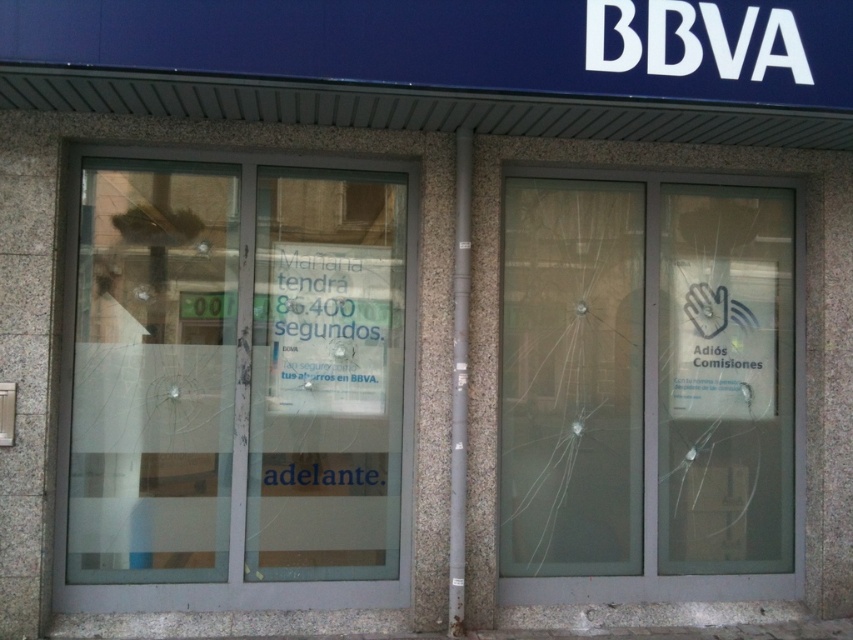
Is transparent glass door at center below transparent glass door at right?

Actually, transparent glass door at center is above transparent glass door at right.

Where is `transparent glass door at center`? transparent glass door at center is located at coordinates [239, 381].

This screenshot has width=853, height=640. Describe the element at coordinates (239, 381) in the screenshot. I see `transparent glass door at center` at that location.

Locate an element on the screen. transparent glass door at center is located at coordinates (239, 381).